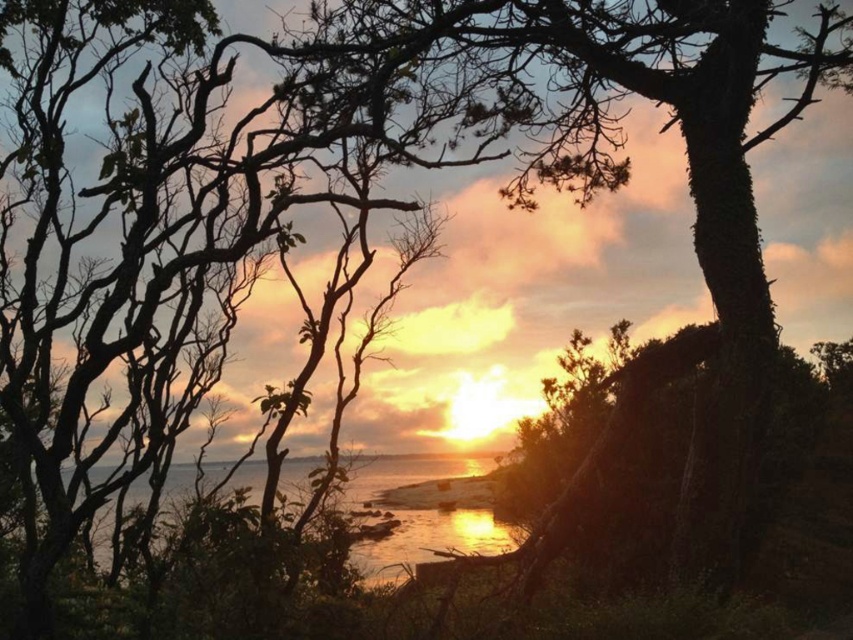
Consider the image. Is green mossy tree at center thinner than shiny metallic water at center?

Correct, green mossy tree at center's width is less than shiny metallic water at center's.

Between point (752, 380) and point (480, 522), which one is positioned in front?

Point (752, 380)

At what (x,y) coordinates should I click in order to perform the action: click on green mossy tree at center. Please return your answer as a coordinate pair (x, y). The height and width of the screenshot is (640, 853). Looking at the image, I should click on (598, 154).